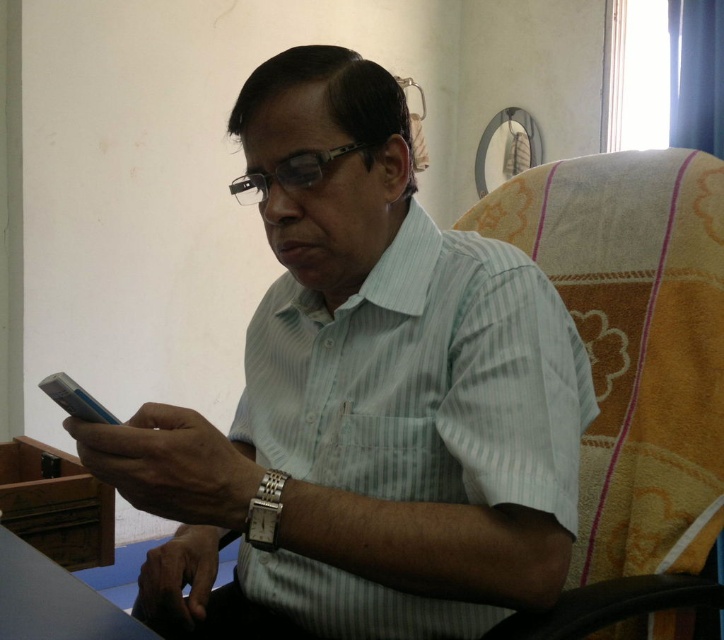
Is white striped shirt at center positioned in front of smooth wooden table at lower left?

That is False.

Is point (523, 403) closer to viewer compared to point (67, 582)?

Yes, it is.

Where is `white striped shirt at center`? The height and width of the screenshot is (640, 724). white striped shirt at center is located at coordinates (363, 400).

Between point (222, 456) and point (636, 154), which one is positioned in front?

Point (222, 456) is in front.

Find the location of a particular element. This screenshot has height=640, width=724. white striped shirt at center is located at coordinates (363, 400).

The height and width of the screenshot is (640, 724). In order to click on white striped shirt at center in this screenshot , I will do `click(363, 400)`.

What are the coordinates of `white striped shirt at center` in the screenshot? It's located at (363, 400).

Consider the image. Is beige fabric swivel chair at right positioned in front of smooth wooden table at lower left?

No, beige fabric swivel chair at right is further to the viewer.

Does beige fabric swivel chair at right appear over smooth wooden table at lower left?

Correct, beige fabric swivel chair at right is located above smooth wooden table at lower left.

Does point (702, 506) come in front of point (4, 618)?

No, it is behind (4, 618).

This screenshot has height=640, width=724. In order to click on beige fabric swivel chair at right in this screenshot , I will do (634, 342).